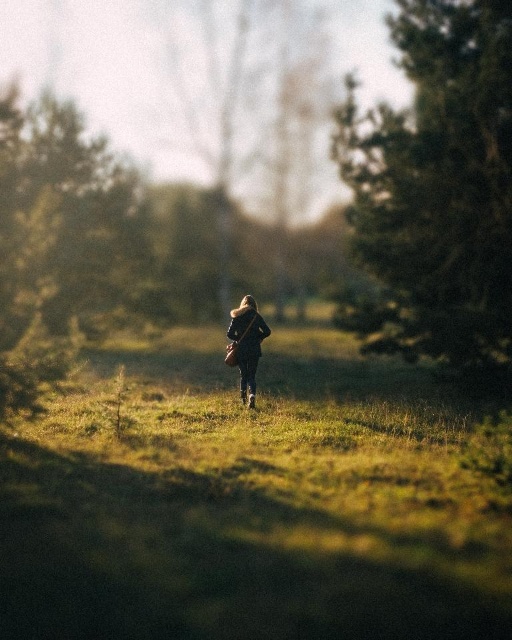
Question: Can you confirm if green grass at center is smaller than green textured tree at left?

Choices:
 (A) no
 (B) yes

Answer: (B)

Question: Can you confirm if green textured tree at right is positioned to the right of dark brown leather jacket at center?

Choices:
 (A) no
 (B) yes

Answer: (B)

Question: Considering the relative positions of green grass at center and green textured tree at right in the image provided, where is green grass at center located with respect to green textured tree at right?

Choices:
 (A) right
 (B) left

Answer: (B)

Question: Which of the following is the closest to the observer?

Choices:
 (A) (424, 268)
 (B) (247, 604)
 (C) (234, 317)

Answer: (B)

Question: Which object is closer to the camera taking this photo?

Choices:
 (A) green grass at center
 (B) dark brown leather jacket at center

Answer: (A)

Question: Which object is closer to the camera taking this photo?

Choices:
 (A) green grass at center
 (B) green textured tree at left
 (C) green textured tree at right
 (D) dark brown leather jacket at center

Answer: (A)